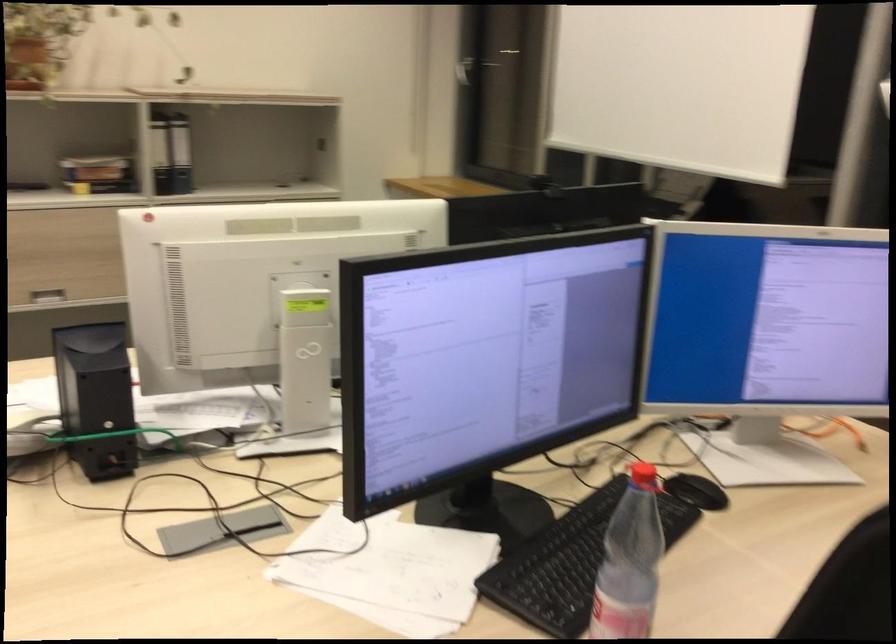
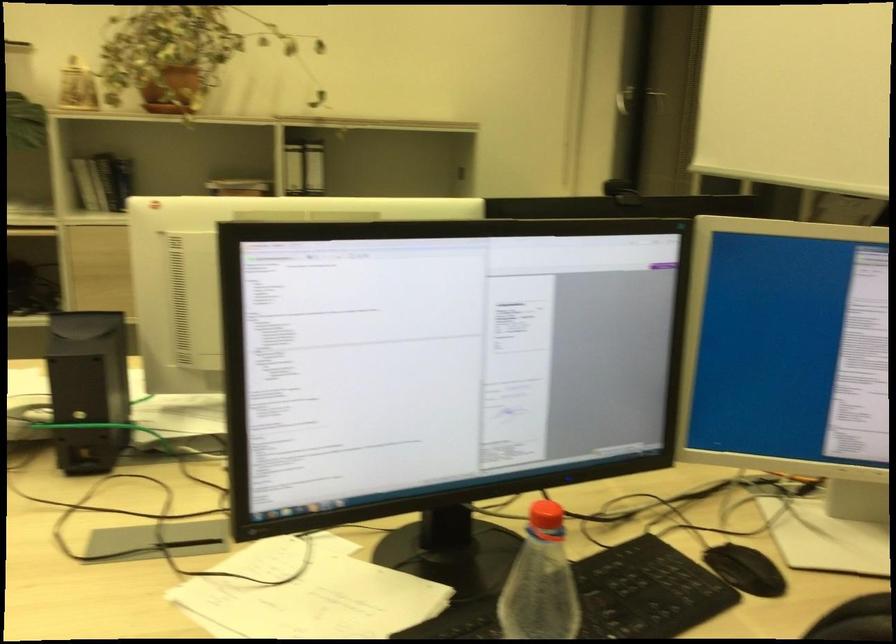
Which direction would the cameraman need to move to produce the second image?

The cameraman moved toward right, forward.